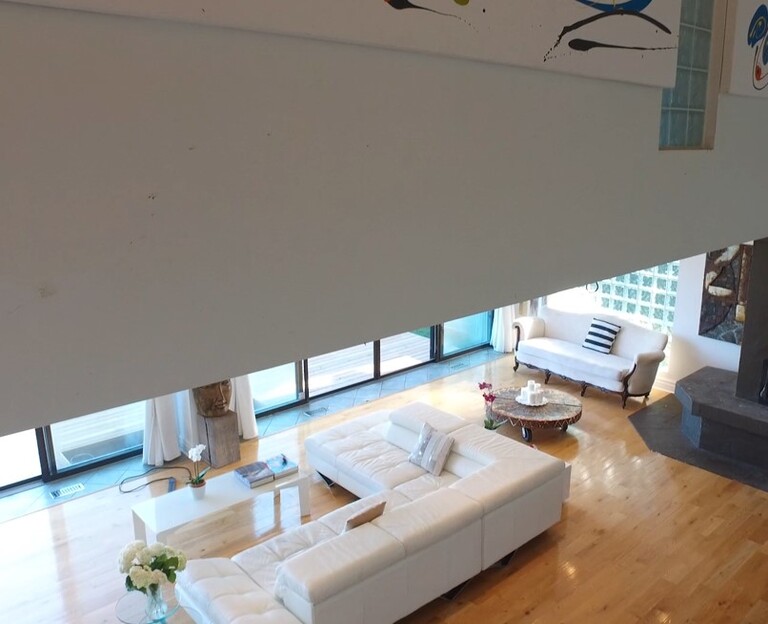
You are a GUI agent. You are given a task and a screenshot of the screen. Output one action in this format:
    pyautogui.click(x=<x>, y=<y>)
    Task: Click on the cushion
    The height and width of the screenshot is (624, 768).
    Given the screenshot: What is the action you would take?
    pyautogui.click(x=432, y=451), pyautogui.click(x=601, y=344)